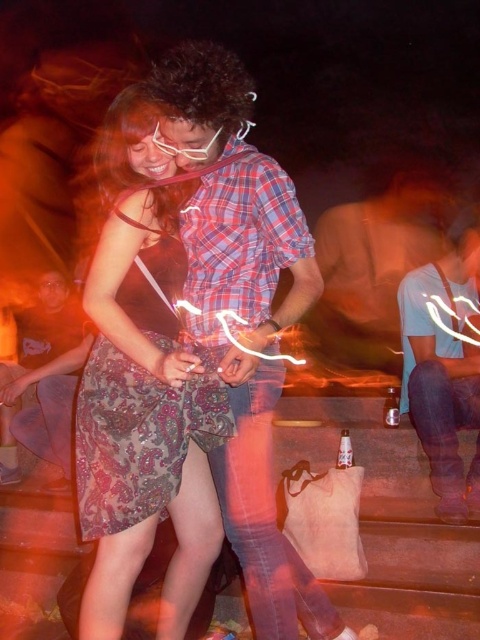
You are at a nighttime party and want to take a photo of both the patterned fabric dress at center and the blue denim jeans at lower right. Which one should you focus on first to ensure both are in focus?

You should focus on the patterned fabric dress at center first because it is closer to you than the blue denim jeans at lower right, so adjusting focus from near to far will help both be in focus.

You are at a nighttime outdoor party and want to take a photo of the patterned fabric dress at center and the brushed metal water at bottle left. Which object should you focus on first to ensure both are in focus?

The patterned fabric dress at center is in front of the brushed metal water at bottle left, so you should focus on the patterned fabric dress at center first to ensure both are in focus.